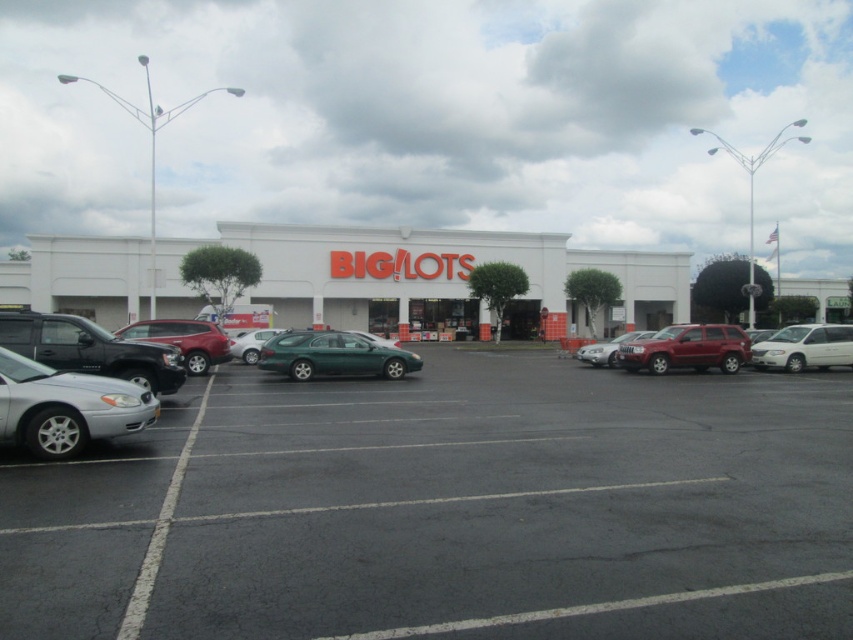
Can you confirm if shiny black suv at left is positioned to the left of green matte station wagon at center?

Correct, you'll find shiny black suv at left to the left of green matte station wagon at center.

Which is more to the right, shiny black suv at left or green matte station wagon at center?

From the viewer's perspective, green matte station wagon at center appears more on the right side.

You are a GUI agent. You are given a task and a screenshot of the screen. Output one action in this format:
    pyautogui.click(x=<x>, y=<y>)
    Task: Click on the shiny black suv at left
    This screenshot has width=853, height=640.
    Given the screenshot: What is the action you would take?
    pyautogui.click(x=90, y=349)

Which is more to the left, satin silver sedan at lower left or shiny red suv at center right?

satin silver sedan at lower left is more to the left.

Which is in front, point (32, 378) or point (633, 340)?

Point (32, 378) is more forward.

Is point (45, 369) less distant than point (723, 369)?

Yes, point (45, 369) is in front of point (723, 369).

Find the location of a particular element. Image resolution: width=853 pixels, height=640 pixels. satin silver sedan at lower left is located at coordinates (67, 406).

Is satin silver sedan at lower left to the right of white matte van at right from the viewer's perspective?

Incorrect, satin silver sedan at lower left is not on the right side of white matte van at right.

Between point (57, 380) and point (820, 346), which one is positioned in front?

Point (57, 380) is in front.

Is point (88, 380) behind point (775, 339)?

No.

Find the location of `satin silver sedan at lower left`. satin silver sedan at lower left is located at coordinates (67, 406).